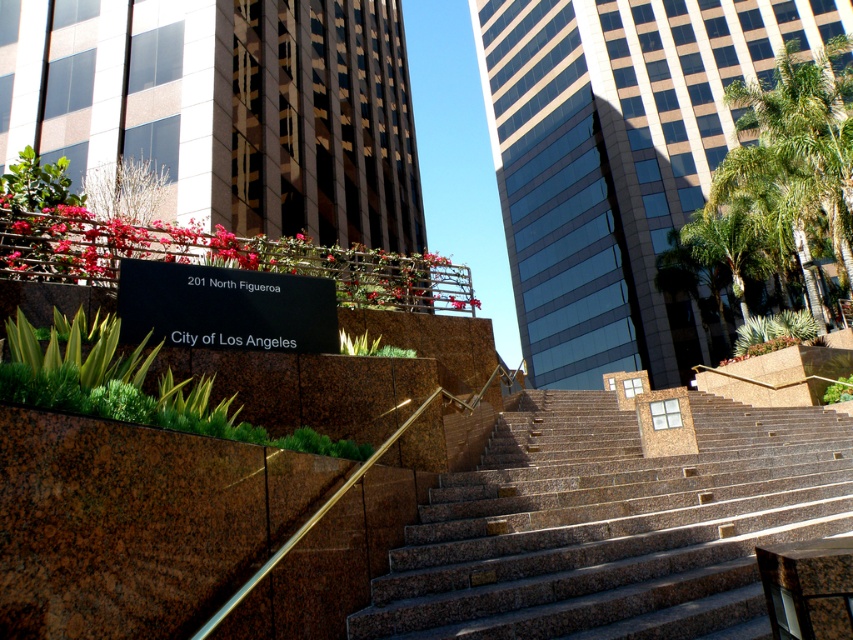
Question: Which point is farther from the camera taking this photo?

Choices:
 (A) (643, 493)
 (B) (769, 230)

Answer: (B)

Question: Which point is farther to the camera?

Choices:
 (A) brown granite stairs at center
 (B) green leafy palm tree at upper right

Answer: (B)

Question: Can you confirm if brown granite stairs at center is positioned above green leafy palm tree at upper right?

Choices:
 (A) yes
 (B) no

Answer: (B)

Question: Which point is closer to the camera?

Choices:
 (A) green leafy palm tree at upper right
 (B) brown granite stairs at center

Answer: (B)

Question: Is brown granite stairs at center to the right of green leafy palm tree at upper right from the viewer's perspective?

Choices:
 (A) yes
 (B) no

Answer: (B)

Question: Can you confirm if brown granite stairs at center is bigger than green leafy palm tree at upper right?

Choices:
 (A) yes
 (B) no

Answer: (B)